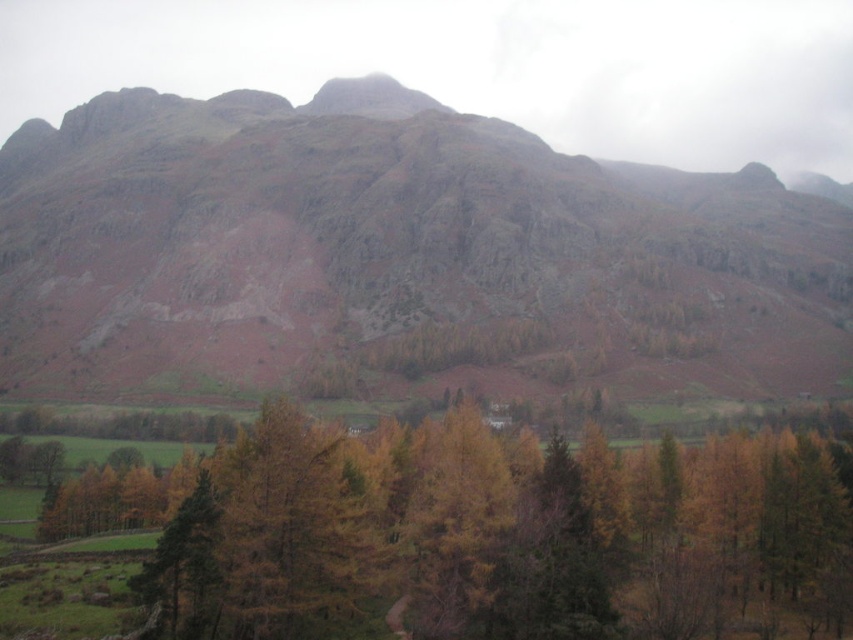
Question: Can you confirm if rusty rock mountain at center is thinner than yellow-brown wood at center?

Choices:
 (A) yes
 (B) no

Answer: (B)

Question: Where is rusty rock mountain at center located in relation to yellow-brown wood at center in the image?

Choices:
 (A) above
 (B) below

Answer: (A)

Question: Which point is farther to the camera?

Choices:
 (A) rusty rock mountain at center
 (B) yellow-brown wood at center

Answer: (A)

Question: Can you confirm if rusty rock mountain at center is bigger than yellow-brown wood at center?

Choices:
 (A) yes
 (B) no

Answer: (A)